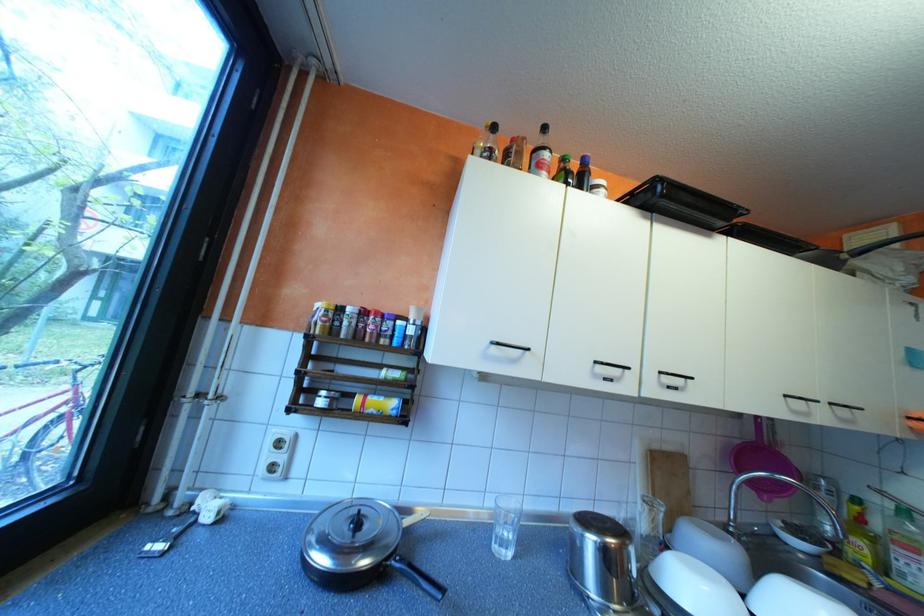
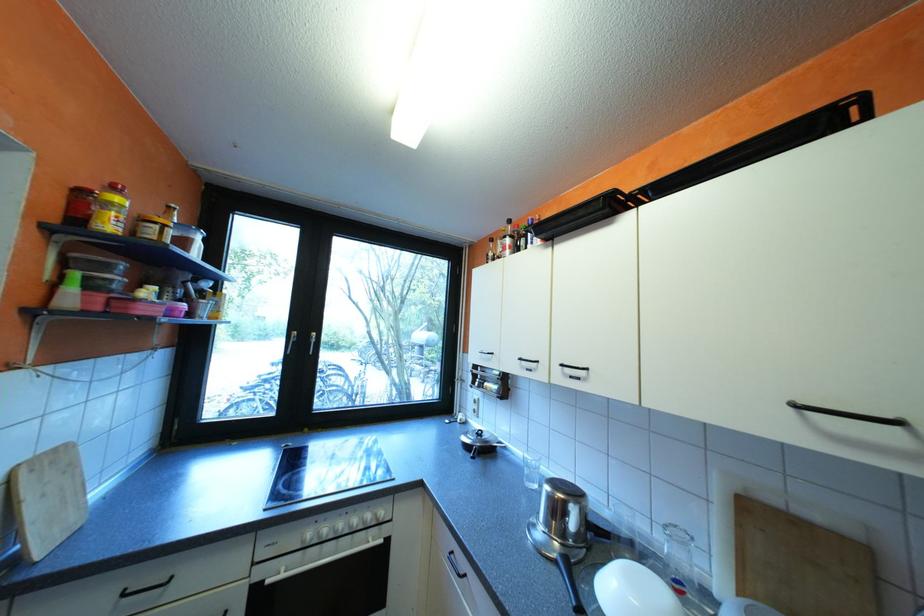
Locate, in the second image, the point that corresponds to (673,383) in the first image.

(576, 373)